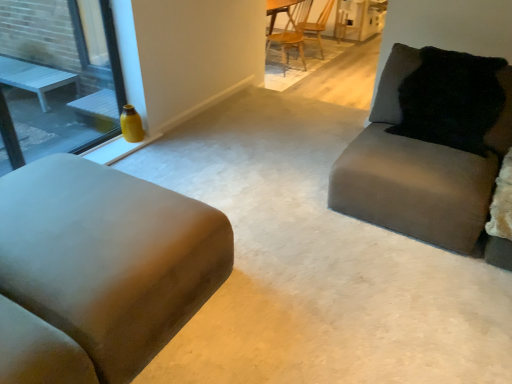
Locate an element on the screen. The image size is (512, 384). wooden chair at upper center, marked as the 2th chair in a back-to-front arrangement is located at coordinates (290, 30).

What do you see at coordinates (290, 30) in the screenshot? I see `wooden chair at upper center, marked as the 2th chair in a back-to-front arrangement` at bounding box center [290, 30].

Find the location of a particular element. The width and height of the screenshot is (512, 384). matte yellow vase at left is located at coordinates (57, 78).

Measure the distance between black fuzzy pillow at upper right and camera.

black fuzzy pillow at upper right and camera are 7.91 feet apart from each other.

In order to click on wooden chair at center, which appears as the 2th chair when viewed from the front in this screenshot , I will do 319,24.

You are a GUI agent. You are given a task and a screenshot of the screen. Output one action in this format:
    pyautogui.click(x=<x>, y=<y>)
    Task: Click on the wooden chair at upper center, the first chair when ordered from front to back
    
    Given the screenshot: What is the action you would take?
    pyautogui.click(x=290, y=30)

In terms of size, does wooden chair at upper center, the first chair when ordered from front to back, appear bigger or smaller than matte yellow vase at left?

Clearly, wooden chair at upper center, the first chair when ordered from front to back, is larger in size than matte yellow vase at left.

Is wooden chair at upper center, the first chair when ordered from front to back, situated inside matte yellow vase at left or outside?

wooden chair at upper center, the first chair when ordered from front to back, lies outside matte yellow vase at left.

Consider the image. In terms of height, does wooden chair at upper center, the first chair when ordered from front to back, look taller or shorter compared to matte yellow vase at left?

In the image, wooden chair at upper center, the first chair when ordered from front to back, appears to be shorter than matte yellow vase at left.

Could you tell me if wooden chair at upper center, marked as the 2th chair in a back-to-front arrangement, is turned towards matte yellow vase at left?

No, wooden chair at upper center, marked as the 2th chair in a back-to-front arrangement, is not facing towards matte yellow vase at left.

Between matte gray couch at right, acting as the 2th studio couch starting from the left, and wooden chair at upper center, the first chair when ordered from front to back, which one has less height?

Standing shorter between the two is matte gray couch at right, acting as the 2th studio couch starting from the left.

The image size is (512, 384). I want to click on studio couch on the right of wooden chair at upper center, marked as the 2th chair in a back-to-front arrangement, so click(x=422, y=175).

From a real-world perspective, is matte gray couch at right, acting as the 2th studio couch starting from the left, physically located above or below wooden chair at upper center, marked as the 2th chair in a back-to-front arrangement?

From a real-world perspective, matte gray couch at right, acting as the 2th studio couch starting from the left, is physically above wooden chair at upper center, marked as the 2th chair in a back-to-front arrangement.

Could you measure the distance between wooden chair at center, arranged as the 1th chair when viewed from the back, and matte yellow vase at left?

A distance of 4.52 meters exists between wooden chair at center, arranged as the 1th chair when viewed from the back, and matte yellow vase at left.

Between wooden chair at center, arranged as the 1th chair when viewed from the back, and matte yellow vase at left, which one has larger width?

wooden chair at center, arranged as the 1th chair when viewed from the back.

Which of these two, wooden chair at center, which appears as the 2th chair when viewed from the front, or matte yellow vase at left, stands taller?

matte yellow vase at left is taller.

Between wooden chair at center, which appears as the 2th chair when viewed from the front, and wooden chair at upper center, the first chair when ordered from front to back, which one has less height?

With less height is wooden chair at center, which appears as the 2th chair when viewed from the front.

You are a GUI agent. You are given a task and a screenshot of the screen. Output one action in this format:
    pyautogui.click(x=<x>, y=<y>)
    Task: Click on the chair located on the left of wooden chair at center, which appears as the 2th chair when viewed from the front
    This screenshot has width=512, height=384.
    Given the screenshot: What is the action you would take?
    pyautogui.click(x=290, y=30)

How many degrees apart are the facing directions of wooden chair at center, arranged as the 1th chair when viewed from the back, and wooden chair at upper center, the first chair when ordered from front to back?

42.9 degrees.

Is wooden chair at center, which appears as the 2th chair when viewed from the front, bigger than wooden chair at upper center, marked as the 2th chair in a back-to-front arrangement?

No.

Is wooden chair at upper center, the first chair when ordered from front to back, aimed at wooden chair at center, arranged as the 1th chair when viewed from the back?

No, wooden chair at upper center, the first chair when ordered from front to back, is not facing towards wooden chair at center, arranged as the 1th chair when viewed from the back.

Who is taller, wooden chair at upper center, marked as the 2th chair in a back-to-front arrangement, or wooden chair at center, arranged as the 1th chair when viewed from the back?

wooden chair at upper center, marked as the 2th chair in a back-to-front arrangement.

From the image's perspective, would you say wooden chair at upper center, marked as the 2th chair in a back-to-front arrangement, is shown under wooden chair at center, arranged as the 1th chair when viewed from the back?

Yes.

Based on the photo, from a real-world perspective, is wooden chair at upper center, the first chair when ordered from front to back, positioned over wooden chair at center, which appears as the 2th chair when viewed from the front, based on gravity?

Yes, from a real-world perspective, wooden chair at upper center, the first chair when ordered from front to back, is on top of wooden chair at center, which appears as the 2th chair when viewed from the front.

From a real-world perspective, between matte yellow vase at left and wooden chair at upper center, marked as the 2th chair in a back-to-front arrangement, who is vertically lower?

wooden chair at upper center, marked as the 2th chair in a back-to-front arrangement, is physically lower.

Which object is wider, matte yellow vase at left or wooden chair at upper center, marked as the 2th chair in a back-to-front arrangement?

Wider between the two is wooden chair at upper center, marked as the 2th chair in a back-to-front arrangement.

Is matte yellow vase at left not close to wooden chair at upper center, marked as the 2th chair in a back-to-front arrangement?

Absolutely, matte yellow vase at left is distant from wooden chair at upper center, marked as the 2th chair in a back-to-front arrangement.

Which is closer, (104,69) or (296,16)?

Point (104,69).

From the image's perspective, relative to matte gray couch at right, acting as the 2th studio couch starting from the left, is wooden chair at center, arranged as the 1th chair when viewed from the back, above or below?

Based on their image positions, wooden chair at center, arranged as the 1th chair when viewed from the back, is located above matte gray couch at right, acting as the 2th studio couch starting from the left.

Which is in front, wooden chair at center, which appears as the 2th chair when viewed from the front, or matte gray couch at right, acting as the 2th studio couch starting from the left?

matte gray couch at right, acting as the 2th studio couch starting from the left, is closer to the camera.

Can you confirm if wooden chair at center, arranged as the 1th chair when viewed from the back, is positioned to the right of matte gray couch at right, which appears as the first studio couch when viewed from the right?

No, wooden chair at center, arranged as the 1th chair when viewed from the back, is not to the right of matte gray couch at right, which appears as the first studio couch when viewed from the right.

You are a GUI agent. You are given a task and a screenshot of the screen. Output one action in this format:
    pyautogui.click(x=<x>, y=<y>)
    Task: Click on the 1st chair behind when counting from the matte yellow vase at left
    The height and width of the screenshot is (384, 512).
    Given the screenshot: What is the action you would take?
    pyautogui.click(x=290, y=30)

Identify the location of the 2nd studio couch located above the wooden chair at upper center, marked as the 2th chair in a back-to-front arrangement (from a real-world perspective). (422, 175).

Considering their positions, is matte yellow vase at left positioned further to wooden chair at upper center, the first chair when ordered from front to back, than matte gray couch at right, which appears as the first studio couch when viewed from the right?

matte gray couch at right, which appears as the first studio couch when viewed from the right.

When comparing their distances from black fuzzy pillow at upper right, does wooden chair at center, which appears as the 2th chair when viewed from the front, or wooden chair at upper center, marked as the 2th chair in a back-to-front arrangement, seem further?

wooden chair at center, which appears as the 2th chair when viewed from the front.

When comparing their distances from matte gray couch at right, acting as the 2th studio couch starting from the left, does wooden chair at center, which appears as the 2th chair when viewed from the front, or wooden chair at upper center, the first chair when ordered from front to back, seem closer?

Based on the image, wooden chair at upper center, the first chair when ordered from front to back, appears to be nearer to matte gray couch at right, acting as the 2th studio couch starting from the left.

Estimate the real-world distances between objects in this image. Which object is further from black fuzzy pillow at upper right, suede-like beige couch at left, the 1th studio couch from the left, or wooden chair at center, arranged as the 1th chair when viewed from the back?

Answer: wooden chair at center, arranged as the 1th chair when viewed from the back, is positioned further to the anchor black fuzzy pillow at upper right.

When comparing their distances from wooden chair at upper center, marked as the 2th chair in a back-to-front arrangement, does wooden chair at center, arranged as the 1th chair when viewed from the back, or black fuzzy pillow at upper right seem closer?

Based on the image, wooden chair at center, arranged as the 1th chair when viewed from the back, appears to be nearer to wooden chair at upper center, marked as the 2th chair in a back-to-front arrangement.

Looking at the image, which one is located further to matte gray couch at right, acting as the 2th studio couch starting from the left, suede-like beige couch at left, the 2th studio couch positioned from the right, or wooden chair at upper center, marked as the 2th chair in a back-to-front arrangement?

The object further to matte gray couch at right, acting as the 2th studio couch starting from the left, is wooden chair at upper center, marked as the 2th chair in a back-to-front arrangement.

From the image, which object appears to be nearer to suede-like beige couch at left, the 2th studio couch positioned from the right, matte gray couch at right, which appears as the first studio couch when viewed from the right, or wooden chair at center, which appears as the 2th chair when viewed from the front?

matte gray couch at right, which appears as the first studio couch when viewed from the right.

Looking at this image, when comparing their distances from wooden chair at upper center, the first chair when ordered from front to back, does black fuzzy pillow at upper right or suede-like beige couch at left, the 2th studio couch positioned from the right, seem further?

suede-like beige couch at left, the 2th studio couch positioned from the right, is positioned further to the anchor wooden chair at upper center, the first chair when ordered from front to back.

Where is `window between suede-like beige couch at left, the 2th studio couch positioned from the right, and wooden chair at upper center, marked as the 2th chair in a back-to-front arrangement, along the z-axis`? The width and height of the screenshot is (512, 384). window between suede-like beige couch at left, the 2th studio couch positioned from the right, and wooden chair at upper center, marked as the 2th chair in a back-to-front arrangement, along the z-axis is located at coordinates (57, 78).

The image size is (512, 384). I want to click on pillow between suede-like beige couch at left, the 2th studio couch positioned from the right, and wooden chair at upper center, the first chair when ordered from front to back, in the front-back direction, so click(452, 100).

You are a GUI agent. You are given a task and a screenshot of the screen. Output one action in this format:
    pyautogui.click(x=<x>, y=<y>)
    Task: Click on the studio couch between matte yellow vase at left and matte gray couch at right, acting as the 2th studio couch starting from the left, from left to right
    The image size is (512, 384).
    Given the screenshot: What is the action you would take?
    pyautogui.click(x=109, y=253)

Identify the location of pillow between matte gray couch at right, acting as the 2th studio couch starting from the left, and wooden chair at center, which appears as the 2th chair when viewed from the front, in the front-back direction. (452, 100).